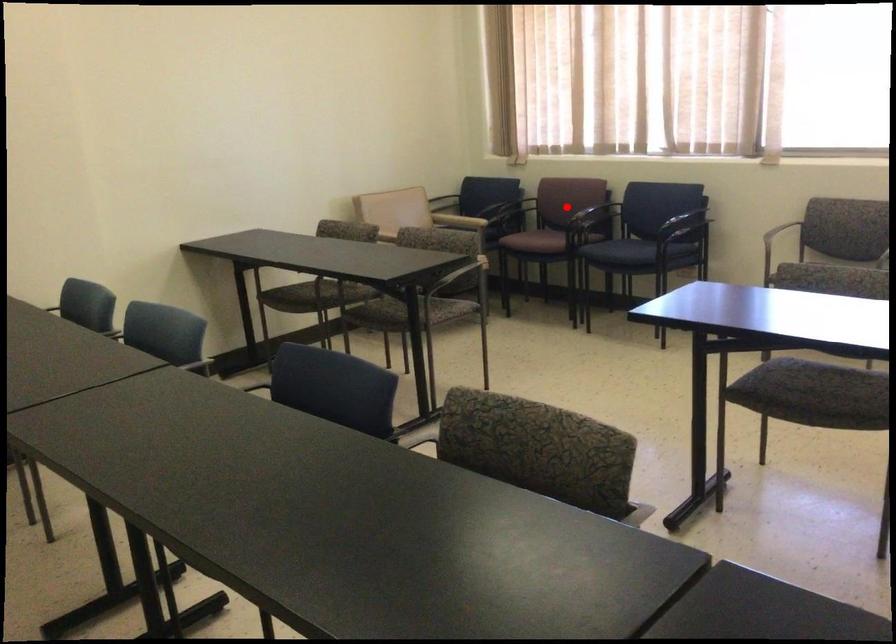
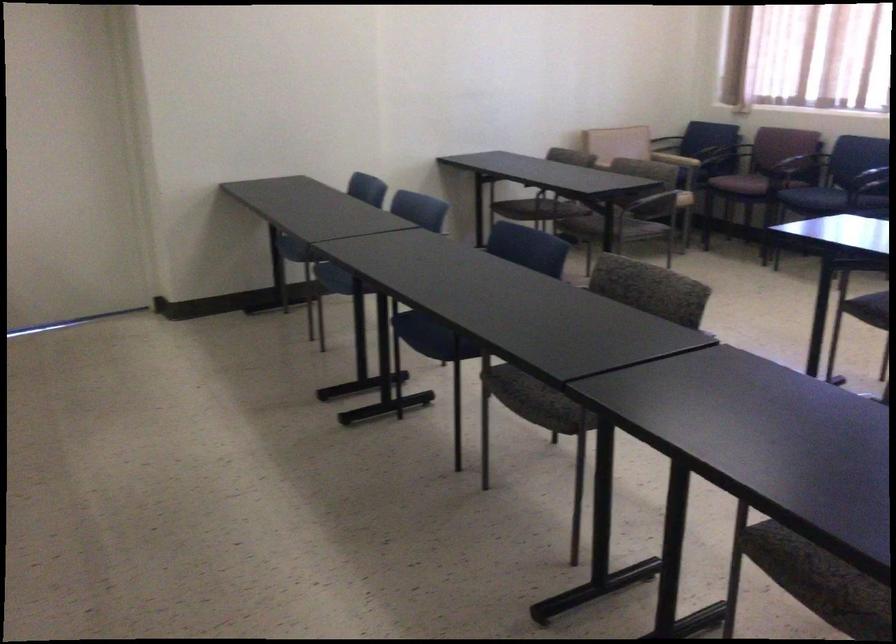
Where in the second image is the point corresponding to the highlighted location from the first image?

(776, 156)